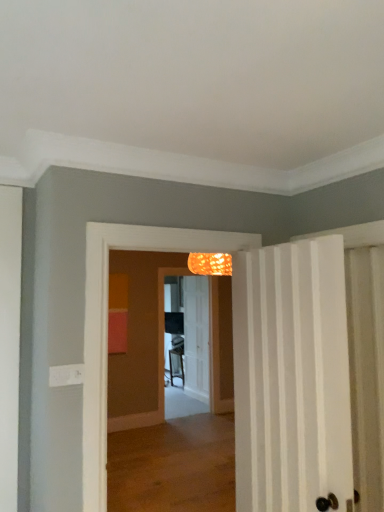
Question: Does white striped door at right, the 2th door in the back-to-front sequence, have a larger size compared to translucent glass screen door at center?

Choices:
 (A) no
 (B) yes

Answer: (B)

Question: Is white striped door at right, the 1th door positioned from the front, not inside translucent glass screen door at center?

Choices:
 (A) no
 (B) yes

Answer: (B)

Question: Can you confirm if white striped door at right, the 2th door in the back-to-front sequence, is wider than translucent glass screen door at center?

Choices:
 (A) yes
 (B) no

Answer: (A)

Question: Is white striped door at right, the 1th door positioned from the front, shorter than translucent glass screen door at center?

Choices:
 (A) yes
 (B) no

Answer: (A)

Question: Does white striped door at right, the 1th door positioned from the front, touch translucent glass screen door at center?

Choices:
 (A) yes
 (B) no

Answer: (B)

Question: Does white striped door at right, the 2th door in the back-to-front sequence, lie in front of translucent glass screen door at center?

Choices:
 (A) yes
 (B) no

Answer: (A)

Question: Considering the relative sizes of white textured door at center, the first door in the back-to-front sequence, and white striped door at right, the 2th door in the back-to-front sequence, in the image provided, is white textured door at center, the first door in the back-to-front sequence, shorter than white striped door at right, the 2th door in the back-to-front sequence,?

Choices:
 (A) no
 (B) yes

Answer: (A)

Question: Can you confirm if white textured door at center, the first door in the back-to-front sequence, is smaller than white striped door at right, the 1th door positioned from the front?

Choices:
 (A) yes
 (B) no

Answer: (A)

Question: From the image's perspective, is white textured door at center, the first door in the back-to-front sequence, below white striped door at right, the 1th door positioned from the front?

Choices:
 (A) no
 (B) yes

Answer: (B)

Question: Is white textured door at center, which is counted as the second door, starting from the front, thinner than white striped door at right, the 2th door in the back-to-front sequence?

Choices:
 (A) yes
 (B) no

Answer: (A)

Question: Could white striped door at right, the 2th door in the back-to-front sequence, be considered to be inside white textured door at center, the first door in the back-to-front sequence?

Choices:
 (A) yes
 (B) no

Answer: (B)

Question: Does white textured door at center, the first door in the back-to-front sequence, have a greater width compared to white striped door at right, the 1th door positioned from the front?

Choices:
 (A) yes
 (B) no

Answer: (B)

Question: Can you confirm if white striped door at right, the 2th door in the back-to-front sequence, is positioned to the left of white textured door at center, the first door in the back-to-front sequence?

Choices:
 (A) yes
 (B) no

Answer: (B)